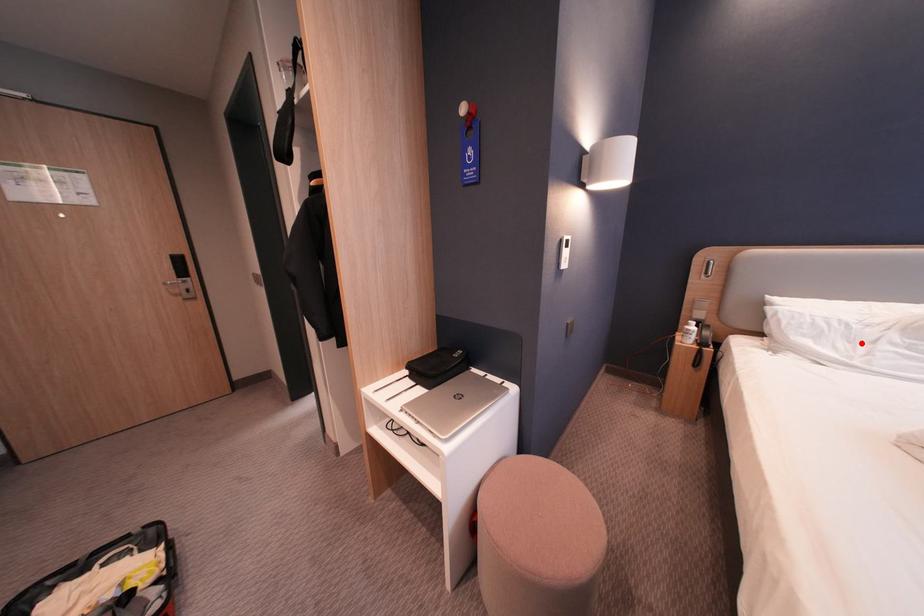
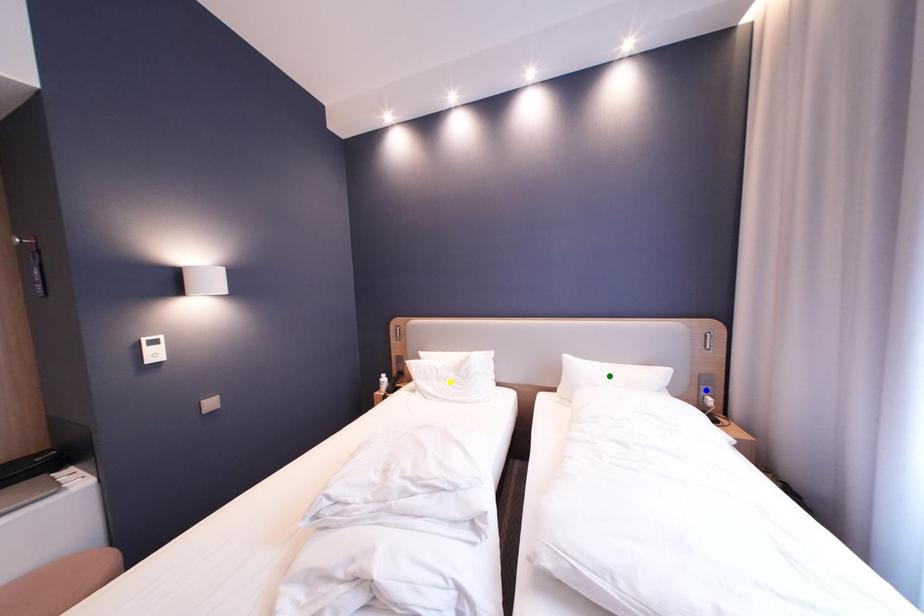
Question: I am providing you with two images of the same scene from different viewpoints. A red point is marked on the first image. You are given multiple points on the second image. Which point in image 2 is actually the same real-world point as the red point in image 1?

Choices:
 (A) blue point
 (B) green point
 (C) yellow point

Answer: (C)